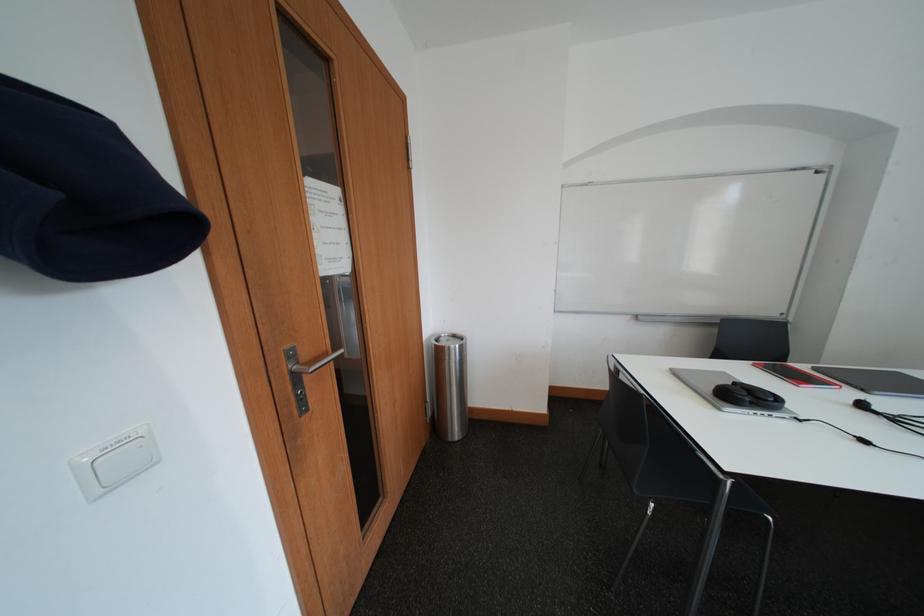
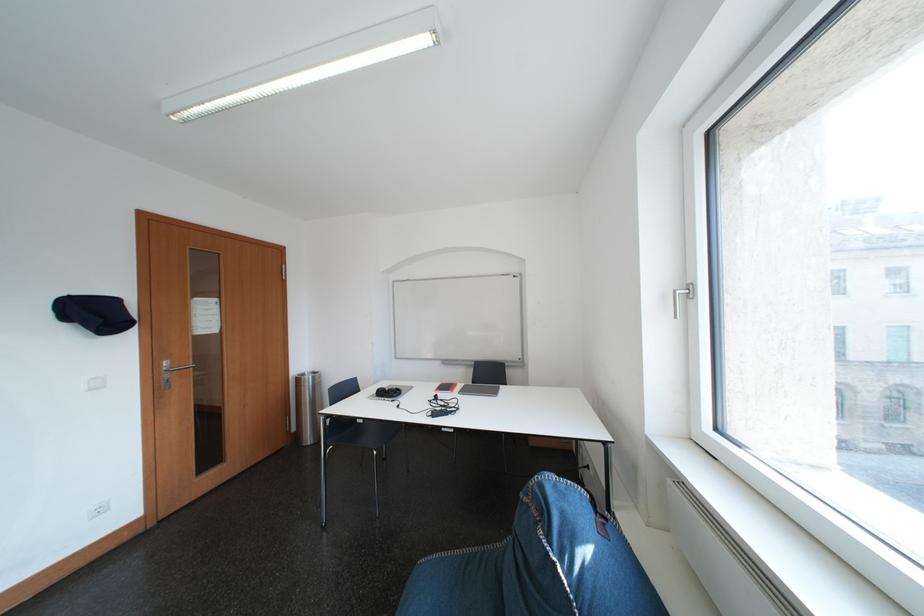
What movement of the cameraman would produce the second image?

The cameraman moved toward right, backward.